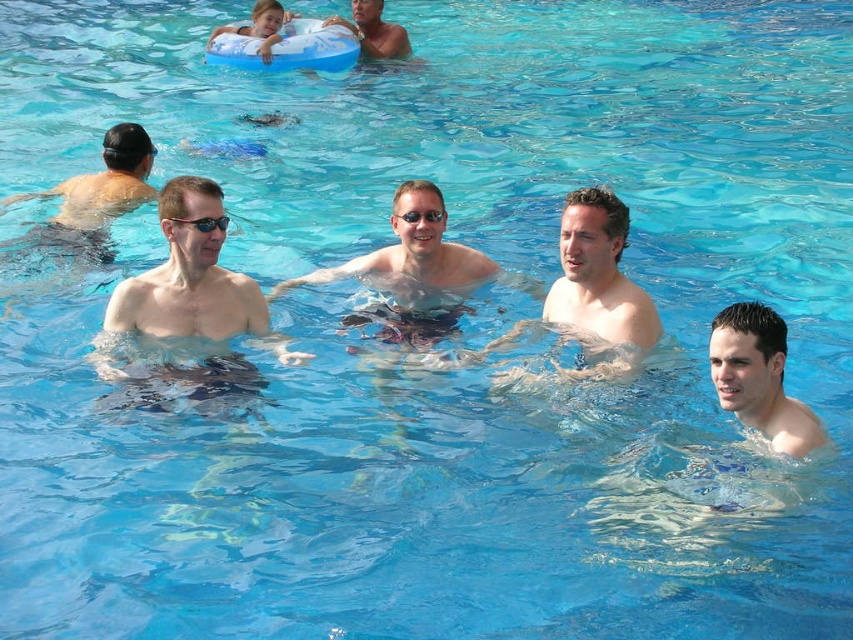
You are a lifeguard observing the pool area. You notice the matte black swim cap at left and the black plastic goggles at left. Which object is taller when viewed from your position?

The matte black swim cap at left is taller than the black plastic goggles at left.

You are a photographer standing at the edge of the pool, and you want to take a photo of both the matte black swim cap at left and the black plastic goggles at left. Which object should you focus on first to ensure both are in clear view?

The matte black swim cap at left is closer to you than the black plastic goggles at left, so you should focus on the matte black swim cap at left first to ensure both are in clear view.